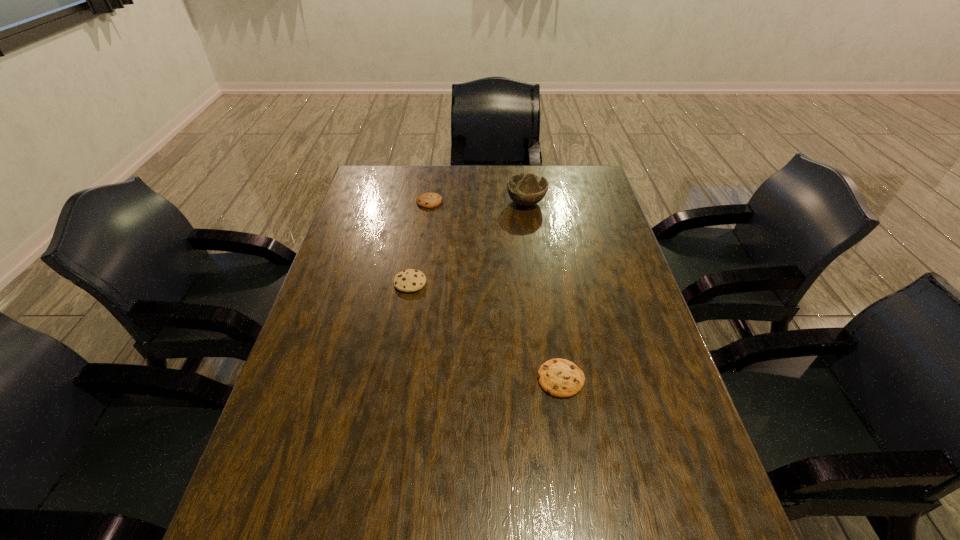
Image resolution: width=960 pixels, height=540 pixels. In order to click on free space between the second tallest object and the bowl in this screenshot , I will do `click(468, 242)`.

You are a GUI agent. You are given a task and a screenshot of the screen. Output one action in this format:
    pyautogui.click(x=<x>, y=<y>)
    Task: Click on the free space between the bowl and the nearest object
    
    Given the screenshot: What is the action you would take?
    pyautogui.click(x=543, y=291)

This screenshot has width=960, height=540. I want to click on free space that is in between the bowl and the second nearest object, so click(468, 242).

You are a GUI agent. You are given a task and a screenshot of the screen. Output one action in this format:
    pyautogui.click(x=<x>, y=<y>)
    Task: Click on the vacant area that lies between the second nearest cookie and the bowl
    
    Given the screenshot: What is the action you would take?
    [x=468, y=242]

Where is `free space between the tallest object and the rightmost cookie`? free space between the tallest object and the rightmost cookie is located at coordinates (543, 291).

In order to click on free space between the shortest cookie and the second tallest cookie in this screenshot , I will do `click(495, 291)`.

Image resolution: width=960 pixels, height=540 pixels. In order to click on unoccupied area between the bowl and the second shortest object in this screenshot , I will do `click(478, 202)`.

Locate which object ranks third in proximity to the rightmost cookie. Please provide its 2D coordinates. Your answer should be formatted as a tuple, i.e. [(x, y)], where the tuple contains the x and y coordinates of a point satisfying the conditions above.

[(426, 200)]

Locate an element on the screen. The height and width of the screenshot is (540, 960). object that stands as the third closest to the rightmost cookie is located at coordinates (426, 200).

Select which cookie appears as the second closest to the third tallest object. Please provide its 2D coordinates. Your answer should be formatted as a tuple, i.e. [(x, y)], where the tuple contains the x and y coordinates of a point satisfying the conditions above.

[(560, 378)]